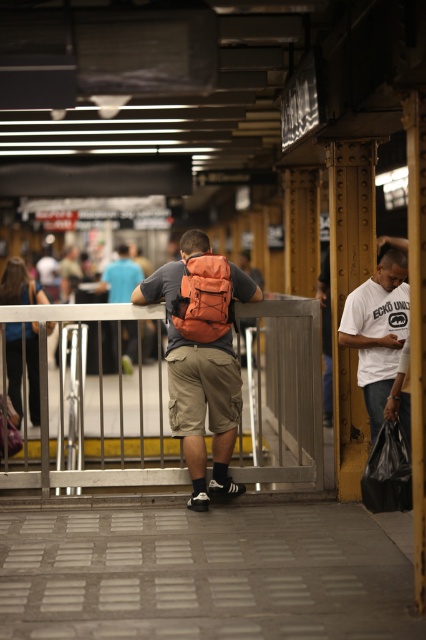
Question: Which object is the farthest from the metallic silver rail at center?

Choices:
 (A) white cotton shirt at right
 (B) matte orange backpack at center
 (C) orange fabric backpack at center

Answer: (B)

Question: Which point is farther to the camera?

Choices:
 (A) khaki cargo shorts at center
 (B) matte orange backpack at center

Answer: (B)

Question: Can you confirm if metallic silver rail at center is bigger than white cotton shirt at right?

Choices:
 (A) yes
 (B) no

Answer: (B)

Question: Can you confirm if white cotton shirt at right is positioned above matte orange backpack at center?

Choices:
 (A) no
 (B) yes

Answer: (A)

Question: Which object appears closest to the camera in this image?

Choices:
 (A) white cotton shirt at right
 (B) metallic silver rail at center
 (C) khaki cargo shorts at center
 (D) orange fabric backpack at center

Answer: (A)

Question: Does orange fabric backpack at center appear over matte orange backpack at center?

Choices:
 (A) no
 (B) yes

Answer: (B)